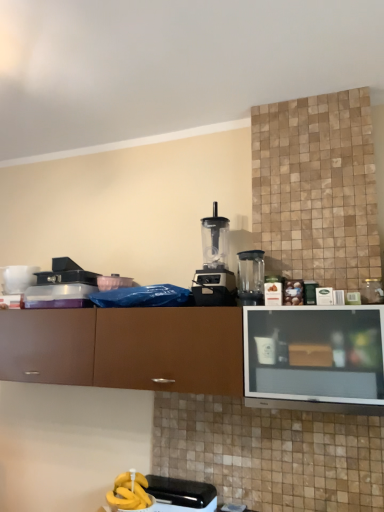
I want to click on blank space situated above black plastic toaster at lower center, the 1th appliance in the front-to-back sequence (from a real-world perspective), so click(x=180, y=482).